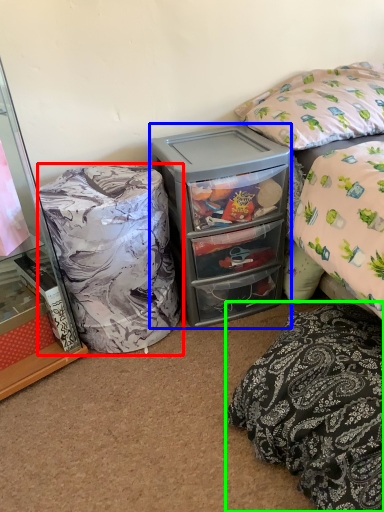
Question: Based on their relative distances, which object is nearer to bean bag chair (highlighted by a red box)? Choose from cooler (highlighted by a blue box) and pillow (highlighted by a green box).

Choices:
 (A) cooler
 (B) pillow

Answer: (A)